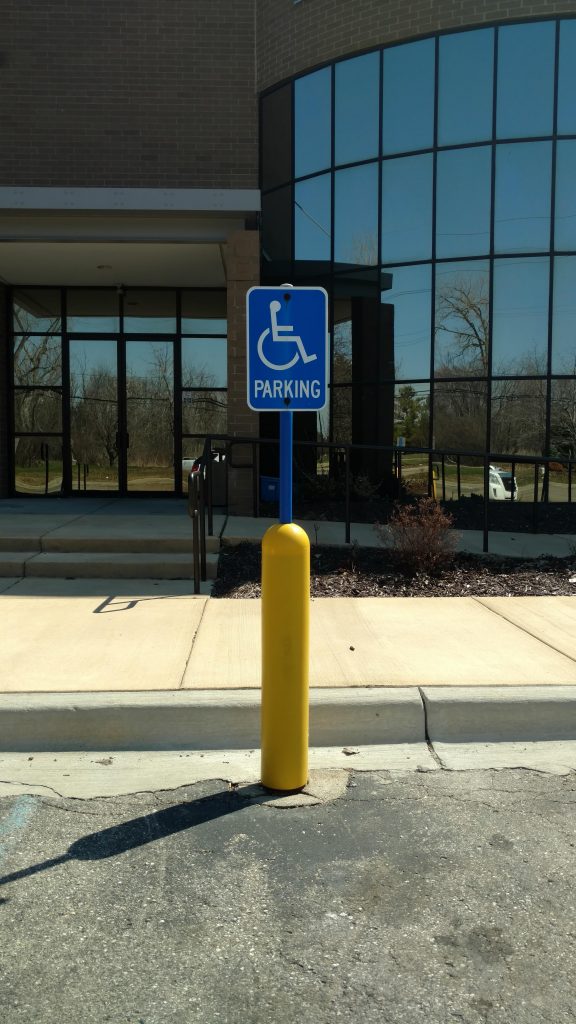
You are a GUI agent. You are given a task and a screenshot of the screen. Output one action in this format:
    pyautogui.click(x=<x>, y=<y>)
    Task: Click on the handrails
    The height and width of the screenshot is (1024, 576).
    Given the screenshot: What is the action you would take?
    pyautogui.click(x=204, y=471), pyautogui.click(x=418, y=449)